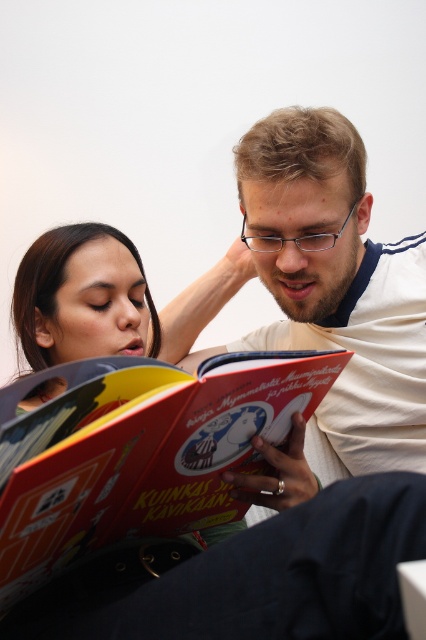
This screenshot has height=640, width=426. I want to click on matte white shirt at center, so click(x=322, y=291).

Between matte white shirt at center and hardcover book at center, which one appears on the right side from the viewer's perspective?

matte white shirt at center is more to the right.

Does point (201, 326) come farther from viewer compared to point (143, 392)?

Yes, point (201, 326) is farther from viewer.

Where is `matte white shirt at center`? Image resolution: width=426 pixels, height=640 pixels. matte white shirt at center is located at coordinates [x=322, y=291].